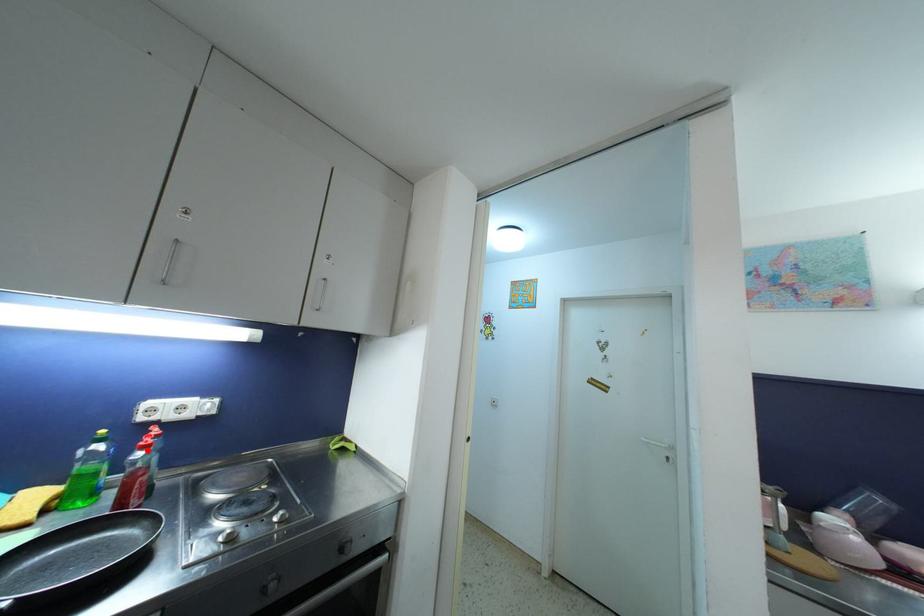
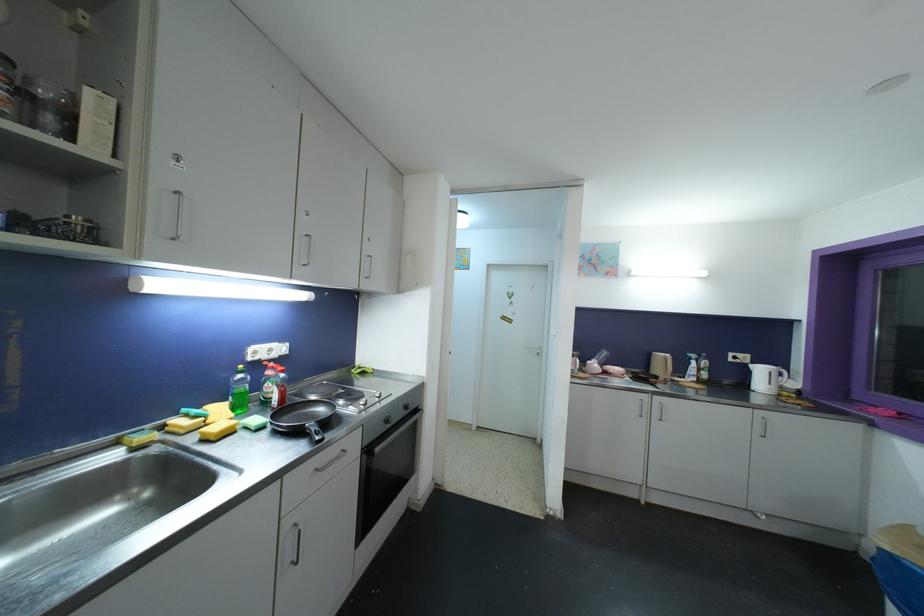
The point at the highlighted location is marked in the first image. Where is the corresponding point in the second image?

(286, 374)